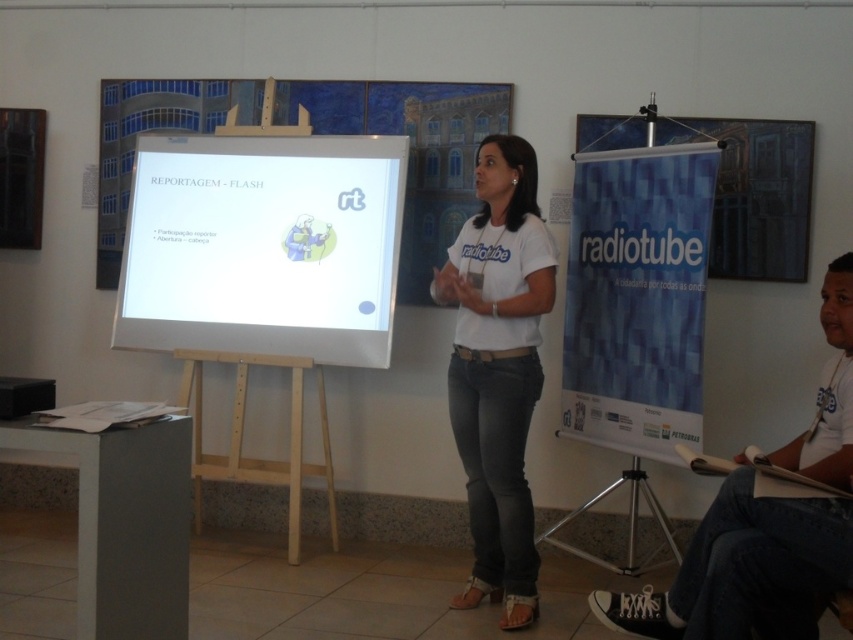
You are setting up a presentation and need to place a laptop between the white glossy projection screen at center and the light wood easel at center. The laptop requires at least 24 inches of space. Can you fit it between them?

The distance between the white glossy projection screen at center and the light wood easel at center is 22.87 inches, which is less than the required 24 inches. Therefore, the laptop cannot fit between them.